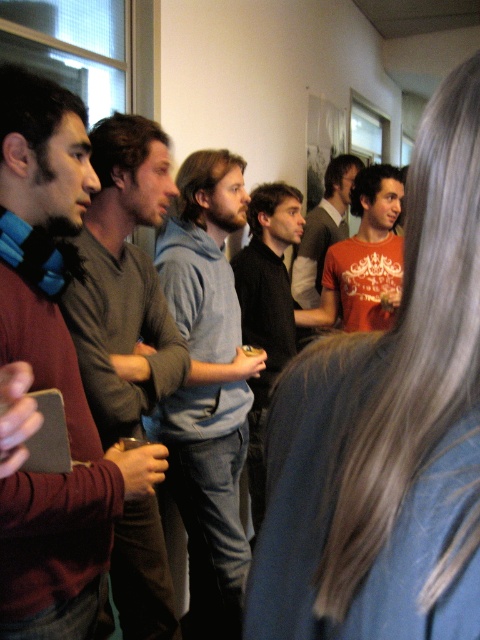
You are standing in the room and want to hand a note to the person wearing the gray sweater at center without disturbing the person in the black matte shirt at center. How can you approach them?

Since the gray sweater at center is positioned on the left side of the black matte shirt at center, you can approach from the left side to reach the gray sweater at center without disturbing the black matte shirt at center.

You are standing in the room and want to touch the gray sweater at center. What are the coordinates where you should reach out to?

The coordinates to reach out to touch the gray sweater at center are point (123, 282).